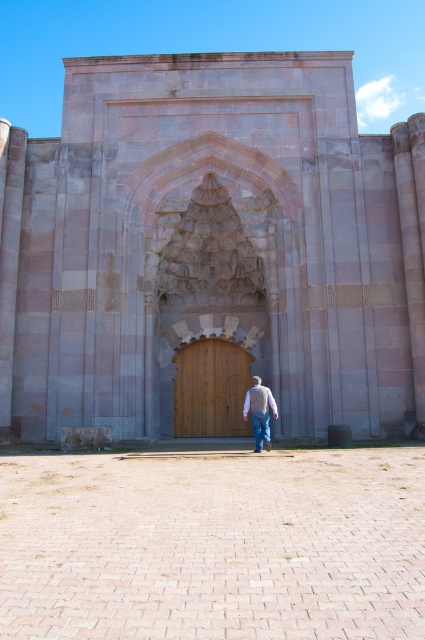
From the picture: You are standing in front of the grand architectural structure described. You need to enter through the wooden door at center. However, there is an obstacle in the form of blue denim jeans at center. Based on their positions, which object is blocking your path to the door?

The blue denim jeans at center is blocking the path to the wooden door at center because the wooden door at center is to the left of the blue denim jeans at center, meaning the jeans are positioned to the right of the door, potentially obstructing access.

You are standing in front of the grand architectural structure and notice a light brown sweater at center and blue denim jeans at center. Which one is nearer to you?

The light brown sweater at center is closer to the viewer than the blue denim jeans at center, so the light brown sweater at center is nearer to you.